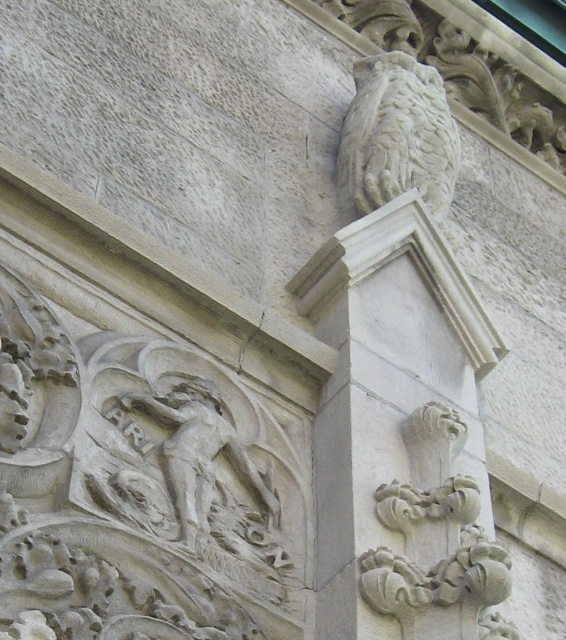
I want to click on white stone column at upper right, so click(396, 426).

Does white stone column at upper right appear on the right side of white stone owl at upper right?

Incorrect, white stone column at upper right is not on the right side of white stone owl at upper right.

Does point (362, 592) come farther from viewer compared to point (418, 99)?

No, it is not.

Where is `white stone column at upper right`? The height and width of the screenshot is (640, 566). white stone column at upper right is located at coordinates (396, 426).

In order to click on white stone column at upper right in this screenshot , I will do `click(396, 426)`.

Who is shorter, white stone carving at center or carved stone figure at upper left?

With less height is carved stone figure at upper left.

From the picture: Does white stone carving at center have a smaller size compared to carved stone figure at upper left?

No.

Identify the location of white stone carving at center. (436, 541).